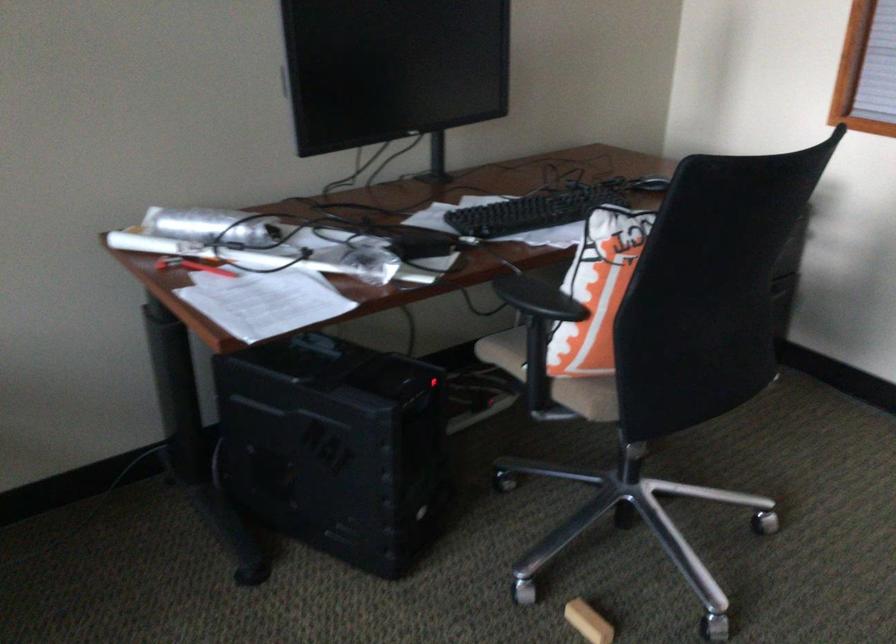
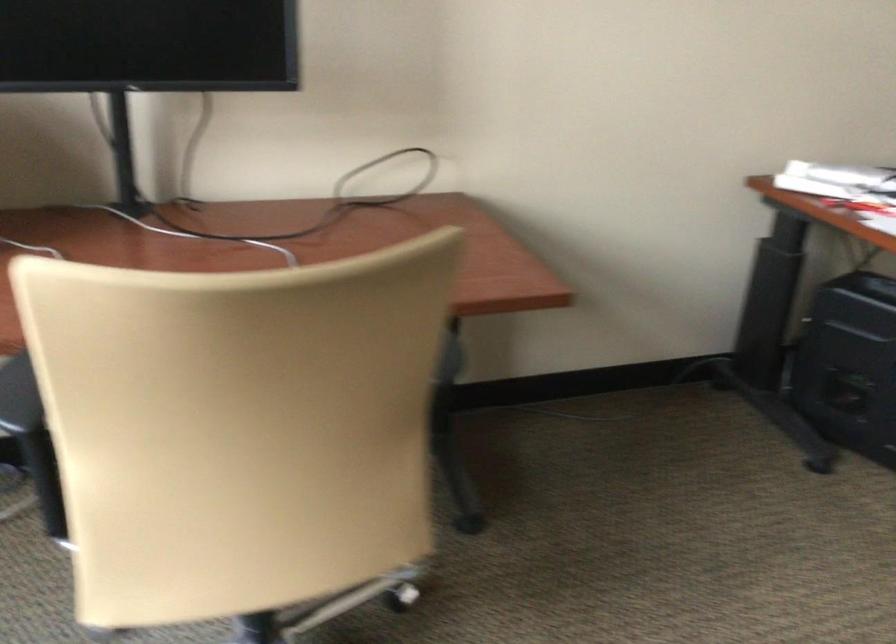
Question: Based on the continuous images, in which direction is the camera rotating? Reply with the corresponding letter.

Choices:
 (A) Left
 (B) Right
 (C) Up
 (D) Down

Answer: (A)